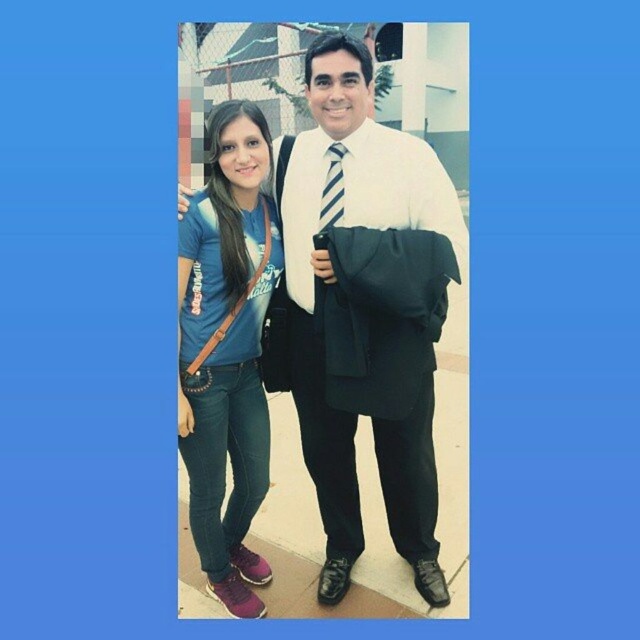
Question: Estimate the real-world distances between objects in this image. Which object is farther from the striped fabric tie at center?

Choices:
 (A) matte black jacket at center
 (B) blue denim jeans at lower left

Answer: (B)

Question: Which is farther from the striped fabric tie at center?

Choices:
 (A) blue denim jeans at lower left
 (B) matte black jacket at center

Answer: (A)

Question: Does matte black jacket at center have a larger size compared to striped fabric tie at center?

Choices:
 (A) yes
 (B) no

Answer: (A)

Question: Which object appears closest to the camera in this image?

Choices:
 (A) blue denim jeans at lower left
 (B) matte black jacket at center
 (C) striped fabric tie at center

Answer: (B)

Question: From the image, what is the correct spatial relationship of matte black jacket at center in relation to striped fabric tie at center?

Choices:
 (A) left
 (B) right

Answer: (B)

Question: Does blue denim jeans at lower left come behind striped fabric tie at center?

Choices:
 (A) no
 (B) yes

Answer: (A)